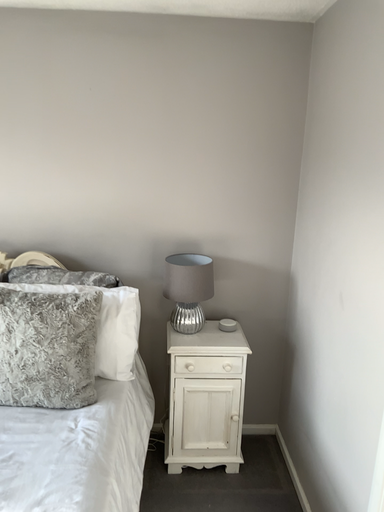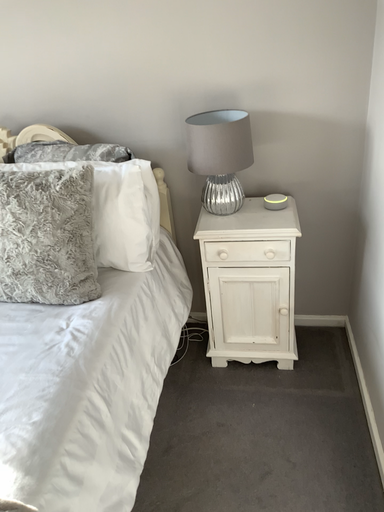
Question: How did the camera likely rotate when shooting the video?

Choices:
 (A) rotated downward
 (B) rotated upward

Answer: (A)